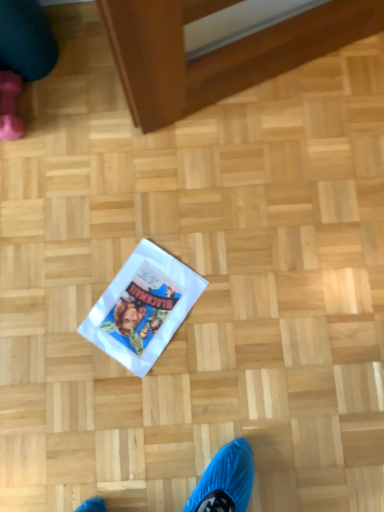
Locate an element on the screen. free space between teal fabric leg at upper left and pink rubber boot at upper left is located at coordinates (47, 108).